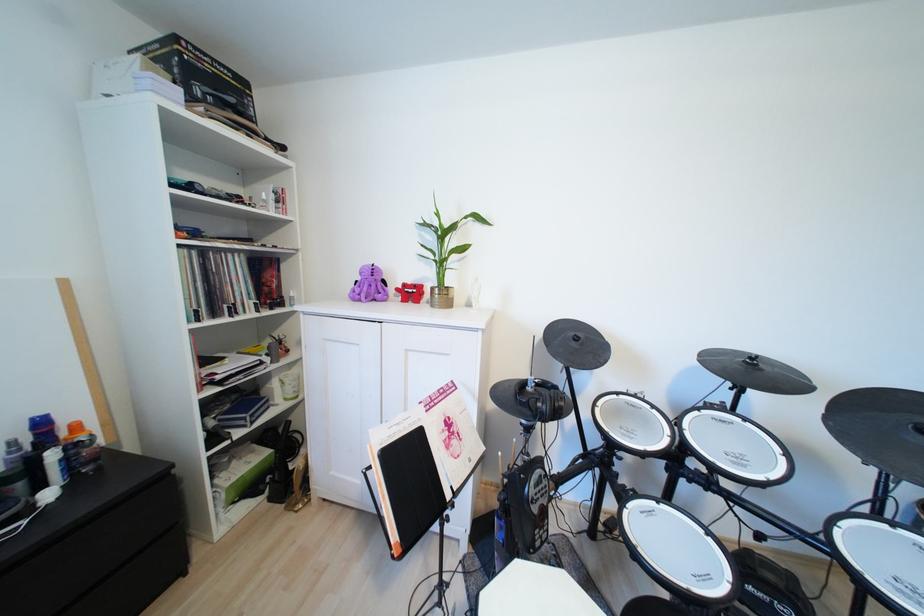
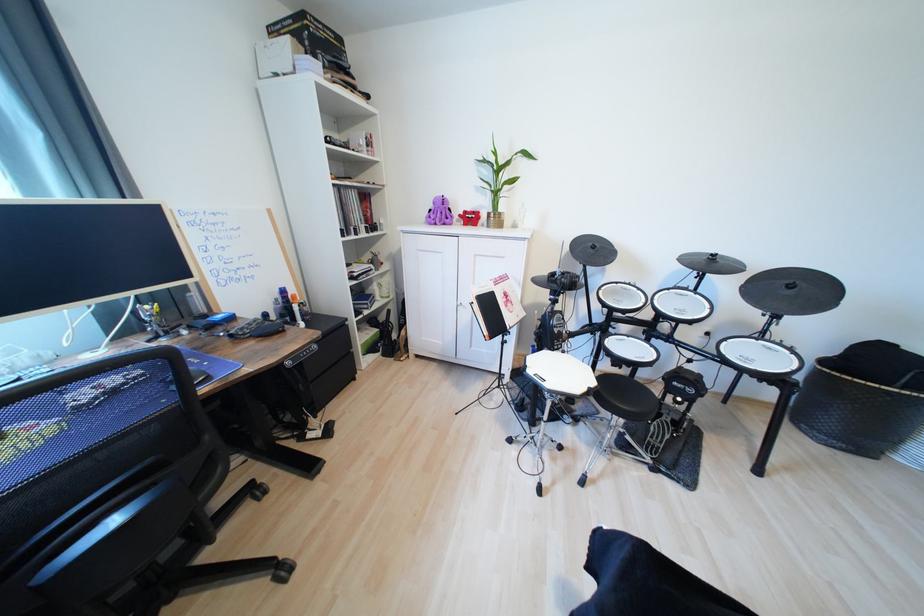
Find the pixel in the second image that matches (x=455, y=448) in the first image.

(513, 307)